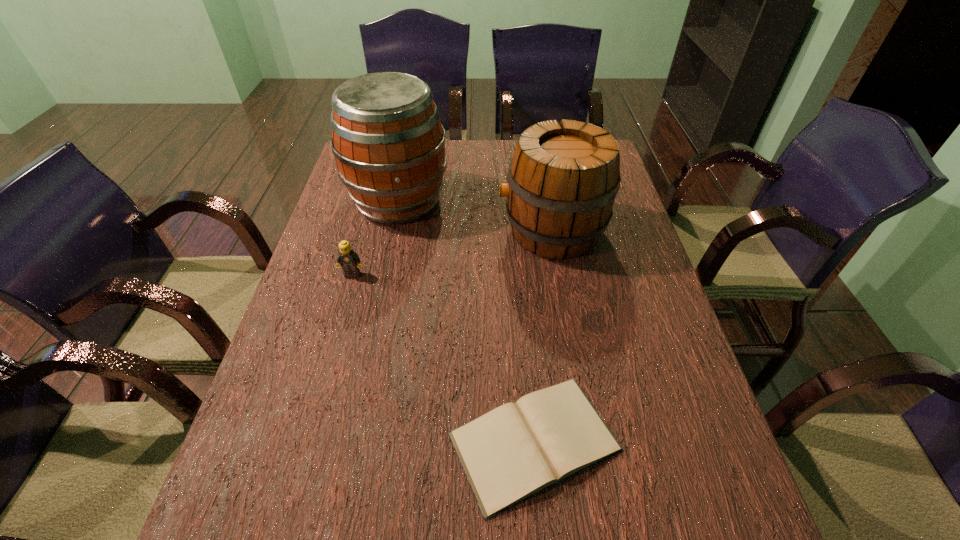
Where is `blank space at the right edge`? The width and height of the screenshot is (960, 540). blank space at the right edge is located at coordinates (690, 490).

You are a GUI agent. You are given a task and a screenshot of the screen. Output one action in this format:
    pyautogui.click(x=<x>, y=<y>)
    Task: Click on the empty space between the Bible and the third farthest object
    This screenshot has width=960, height=540.
    Given the screenshot: What is the action you would take?
    pyautogui.click(x=444, y=358)

You are a GUI agent. You are given a task and a screenshot of the screen. Output one action in this format:
    pyautogui.click(x=<x>, y=<y>)
    Task: Click on the vacant space in between the nearest object and the tallest object
    
    Given the screenshot: What is the action you would take?
    (x=467, y=321)

Find the location of `free spot between the taller cider and the shorter cider`. free spot between the taller cider and the shorter cider is located at coordinates (475, 216).

Locate an element on the screen. This screenshot has height=540, width=960. free point between the nearest object and the taller cider is located at coordinates (467, 321).

You are a GUI agent. You are given a task and a screenshot of the screen. Output one action in this format:
    pyautogui.click(x=<x>, y=<y>)
    Task: Click on the vacant point located between the third farthest object and the tallest object
    The image size is (960, 540).
    Given the screenshot: What is the action you would take?
    pyautogui.click(x=375, y=238)

The image size is (960, 540). I want to click on vacant area that lies between the third farthest object and the tallest object, so click(x=375, y=238).

At what (x,y) coordinates should I click in order to perform the action: click on free space between the nearest object and the right cider. Please return your answer as a coordinate pair (x, y). The height and width of the screenshot is (540, 960). Looking at the image, I should click on (543, 336).

The height and width of the screenshot is (540, 960). I want to click on free space between the tallest object and the Lego, so click(x=375, y=238).

Locate an element on the screen. free space between the third farthest object and the right cider is located at coordinates click(x=452, y=253).